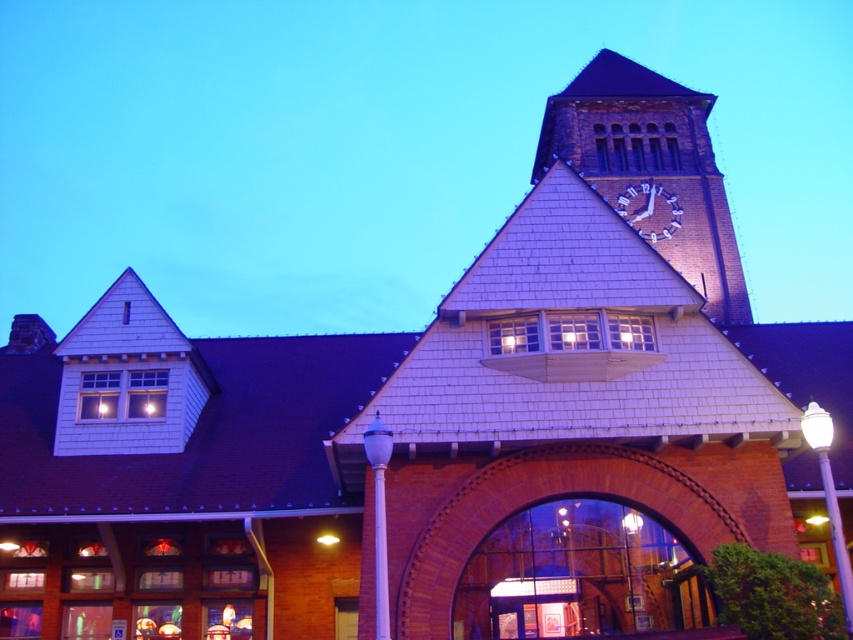
You are standing in front of the historic building and want to reach the metallic silver clock at upper right. The brick clock tower at upper center is blocking your path. Can you walk around it?

The brick clock tower at upper center is 14.97 feet away from the metallic silver clock at upper right. Since the tower is between you and the clock, you can walk around it as they are not adjacent.

You are an architect evaluating the building design. You notice the brick clock tower at upper center and the metallic silver clock at upper right. Which one is bigger in size?

The brick clock tower at upper center is larger in size compared to the metallic silver clock at upper right.

You are standing in front of the historic building and want to determine the relative positions of two points on its facade. The first point is located at coordinates point (x=540, y=157), and the second is at point (x=666, y=221). Which point is closer to you?

Point (x=540, y=157) is closer to you because it is further to the viewer than point (x=666, y=221).